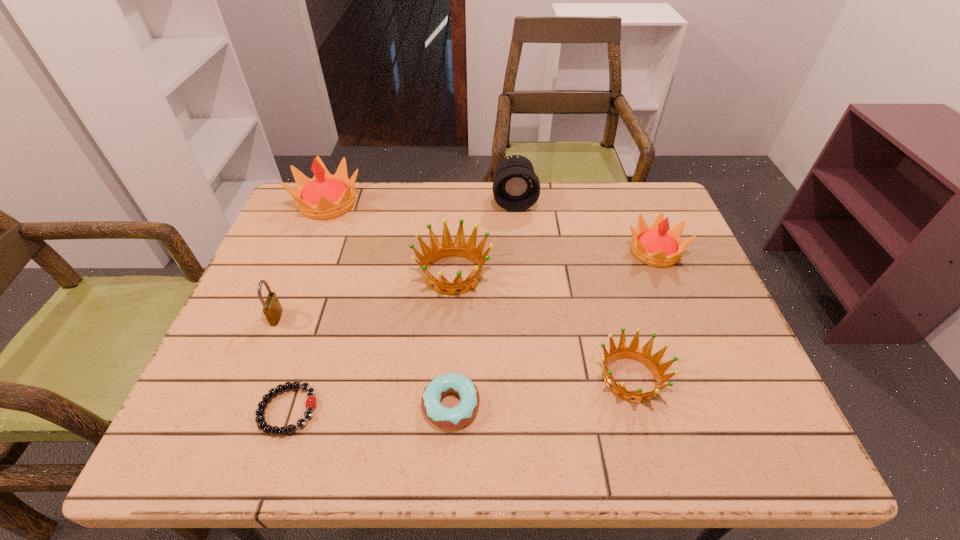
Image resolution: width=960 pixels, height=540 pixels. Find the location of `the left yellow crown`. the left yellow crown is located at coordinates (325, 196).

At what (x,y) coordinates should I click in order to perform the action: click on the farthest crown. Please return your answer as a coordinate pair (x, y). The height and width of the screenshot is (540, 960). Looking at the image, I should click on (325, 196).

Image resolution: width=960 pixels, height=540 pixels. Identify the location of telephoto lens. (516, 187).

This screenshot has height=540, width=960. I want to click on the third object from right to left, so click(516, 187).

Find the location of a particular element. This screenshot has width=960, height=540. the rightmost object is located at coordinates (657, 246).

Locate an element on the screen. This screenshot has height=540, width=960. the third shortest crown is located at coordinates (657, 246).

You are a GUI agent. You are given a task and a screenshot of the screen. Output one action in this format:
    pyautogui.click(x=<x>, y=<y>)
    Task: Click on the brass padlock
    The height and width of the screenshot is (540, 960).
    Given the screenshot: What is the action you would take?
    pyautogui.click(x=272, y=309)

I want to click on padlock, so click(272, 309).

This screenshot has width=960, height=540. I want to click on the third tallest crown, so point(437,251).

Find the location of a particular element. This screenshot has height=540, width=960. the second crown from left to right is located at coordinates (437, 251).